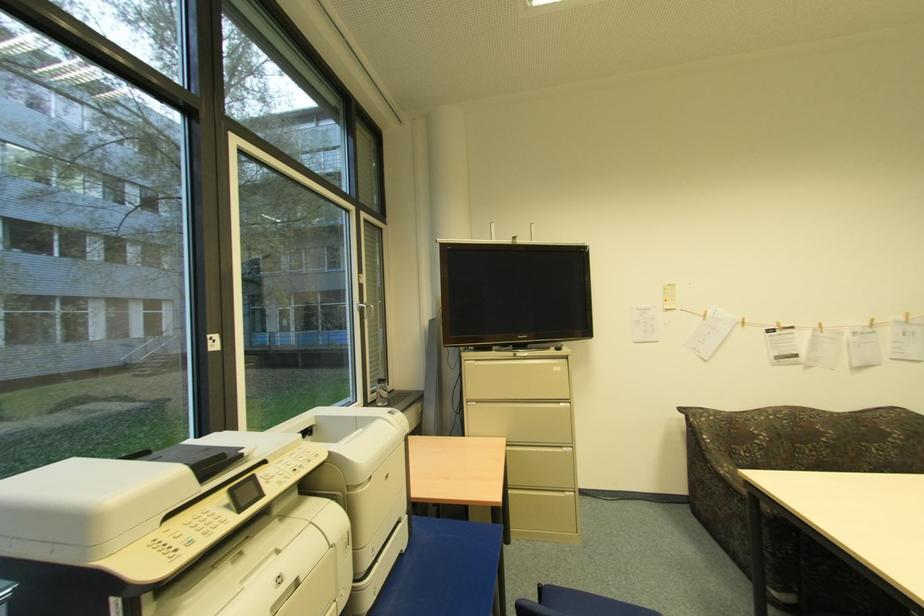
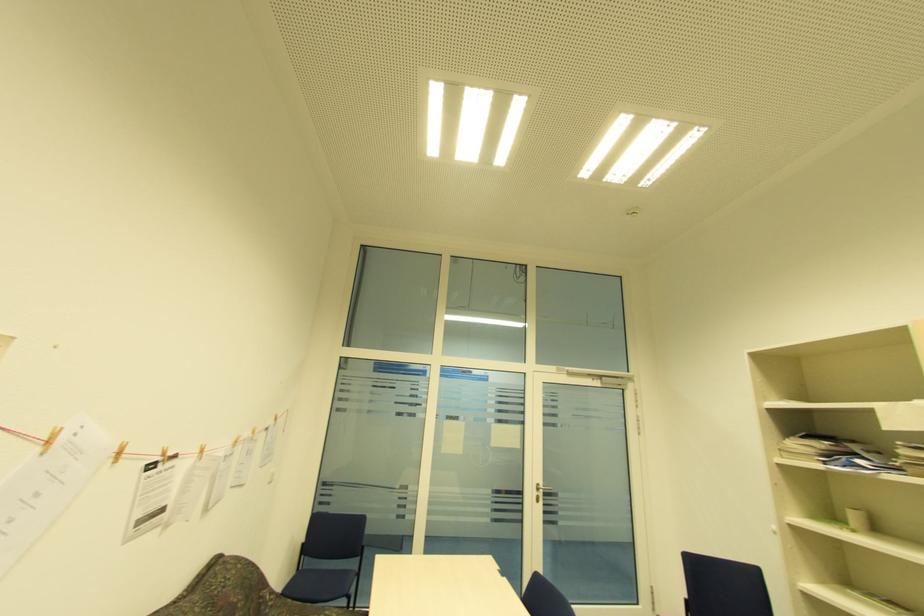
In the second image, find the point that corresponds to the point at 779,325 in the first image.

(163, 454)